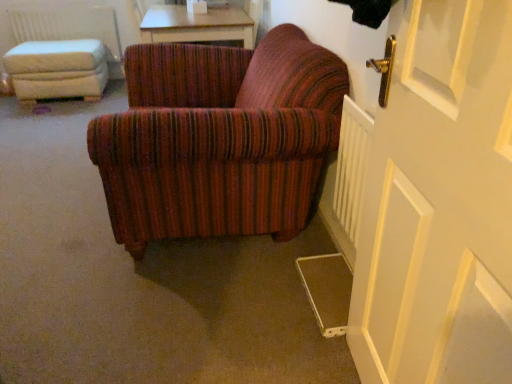
Question: Is white fabric ottoman at left at the left side of light brown wooden table at upper center?

Choices:
 (A) yes
 (B) no

Answer: (A)

Question: Is white fabric ottoman at left not inside light brown wooden table at upper center?

Choices:
 (A) yes
 (B) no

Answer: (A)

Question: Is white fabric ottoman at left not near light brown wooden table at upper center?

Choices:
 (A) no
 (B) yes

Answer: (B)

Question: Is white fabric ottoman at left in contact with light brown wooden table at upper center?

Choices:
 (A) yes
 (B) no

Answer: (B)

Question: Does white fabric ottoman at left come behind light brown wooden table at upper center?

Choices:
 (A) yes
 (B) no

Answer: (A)

Question: Does white fabric ottoman at left appear on the right side of light brown wooden table at upper center?

Choices:
 (A) no
 (B) yes

Answer: (A)

Question: Is white plastic radiator at lower right, acting as the 1th radiator starting from the right, positioned with its back to white fabric ottoman at left?

Choices:
 (A) yes
 (B) no

Answer: (B)

Question: Considering the relative sizes of white plastic radiator at lower right, which appears as the 1th radiator when ordered from the bottom, and white fabric ottoman at left in the image provided, is white plastic radiator at lower right, which appears as the 1th radiator when ordered from the bottom, smaller than white fabric ottoman at left?

Choices:
 (A) yes
 (B) no

Answer: (A)

Question: Is white plastic radiator at lower right, which is the 2th radiator in top-to-bottom order, not inside white fabric ottoman at left?

Choices:
 (A) yes
 (B) no

Answer: (A)

Question: Can you confirm if white plastic radiator at lower right, acting as the 1th radiator starting from the right, is thinner than white fabric ottoman at left?

Choices:
 (A) no
 (B) yes

Answer: (B)

Question: From the image's perspective, is white plastic radiator at lower right, marked as the second radiator in a back-to-front arrangement, on top of white fabric ottoman at left?

Choices:
 (A) no
 (B) yes

Answer: (A)

Question: Is white plastic radiator at lower right, which is the 2th radiator in left-to-right order, oriented towards white fabric ottoman at left?

Choices:
 (A) no
 (B) yes

Answer: (A)

Question: From a real-world perspective, is white wooden door at right positioned over white fabric radiator at upper left, which is the 2th radiator from right to left, based on gravity?

Choices:
 (A) yes
 (B) no

Answer: (A)